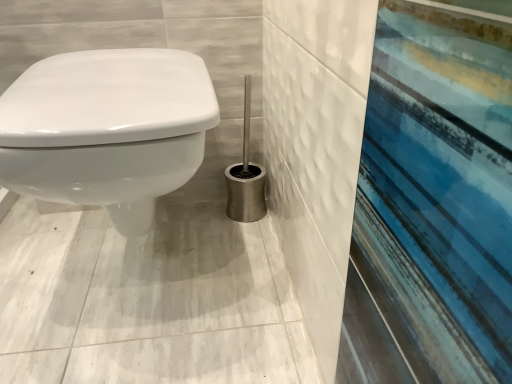
Question: Choose the correct answer: Is satin silver toilet brush at center inside white glossy toilet at left or outside it?

Choices:
 (A) outside
 (B) inside

Answer: (A)

Question: From a real-world perspective, is satin silver toilet brush at center physically located above or below white glossy toilet at left?

Choices:
 (A) below
 (B) above

Answer: (A)

Question: Is point (263, 195) positioned closer to the camera than point (2, 183)?

Choices:
 (A) farther
 (B) closer

Answer: (A)

Question: Based on their positions, is white glossy toilet at left located to the left or right of satin silver toilet brush at center?

Choices:
 (A) right
 (B) left

Answer: (B)

Question: Is point (143, 208) positioned closer to the camera than point (245, 89)?

Choices:
 (A) farther
 (B) closer

Answer: (B)

Question: From the image's perspective, relative to satin silver toilet brush at center, is white glossy toilet at left above or below?

Choices:
 (A) above
 (B) below

Answer: (B)

Question: From their relative heights in the image, would you say white glossy toilet at left is taller or shorter than satin silver toilet brush at center?

Choices:
 (A) tall
 (B) short

Answer: (A)